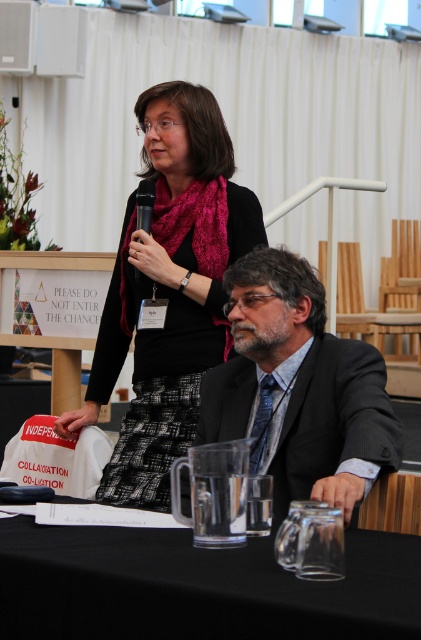
Is black glass table at lower center behind gray suit at center?

That is False.

Can you confirm if black glass table at lower center is bigger than gray suit at center?

Incorrect, black glass table at lower center is not larger than gray suit at center.

Is point (226, 552) positioned before point (298, 304)?

Yes, point (226, 552) is closer to viewer.

Image resolution: width=421 pixels, height=640 pixels. I want to click on black glass table at lower center, so click(197, 586).

Does black glass table at lower center have a greater height compared to black plastic microphone at upper center?

No.

Who is more forward, (298, 632) or (138, 195)?

Point (298, 632)

Is point (271, 592) less distant than point (143, 220)?

Yes, it is.

You are a GUI agent. You are given a task and a screenshot of the screen. Output one action in this format:
    pyautogui.click(x=<x>, y=<y>)
    Task: Click on the black glass table at lower center
    Image resolution: width=421 pixels, height=640 pixels.
    Given the screenshot: What is the action you would take?
    pyautogui.click(x=197, y=586)

Who is lower down, matte black scarf at upper center or black plastic microphone at upper center?

matte black scarf at upper center is below.

The width and height of the screenshot is (421, 640). I want to click on matte black scarf at upper center, so point(168,291).